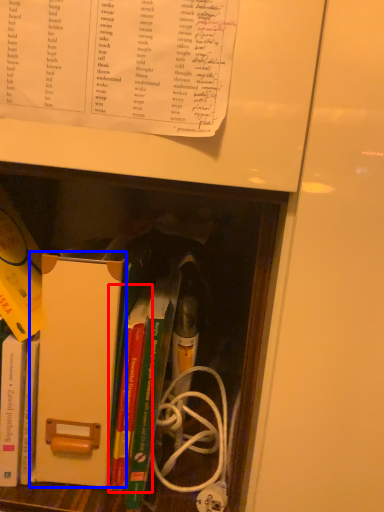
Question: Among these objects, which one is farthest to the camera, book (highlighted by a red box) or paperback book (highlighted by a blue box)?

Choices:
 (A) book
 (B) paperback book

Answer: (A)